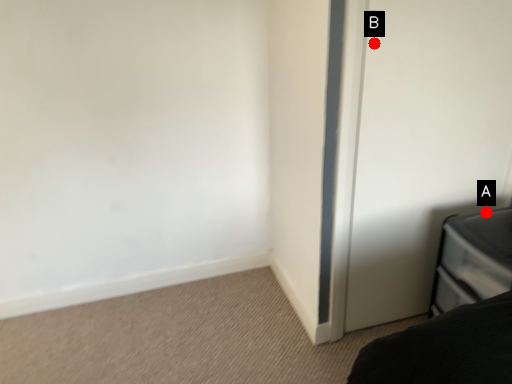
Question: Two points are circled on the image, labeled by A and B beside each circle. Which point is closer to the camera?

Choices:
 (A) A is closer
 (B) B is closer

Answer: (B)